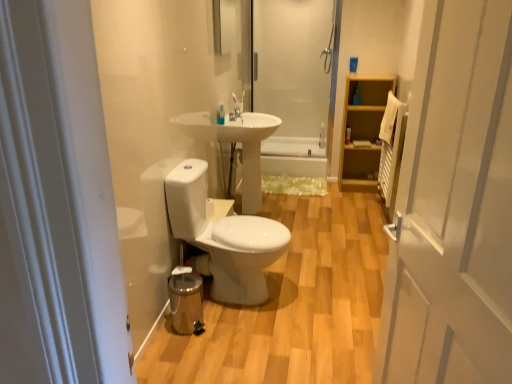
Locate an element on the screen. The height and width of the screenshot is (384, 512). vacant space underneath white glossy toilet at center (from a real-world perspective) is located at coordinates (243, 300).